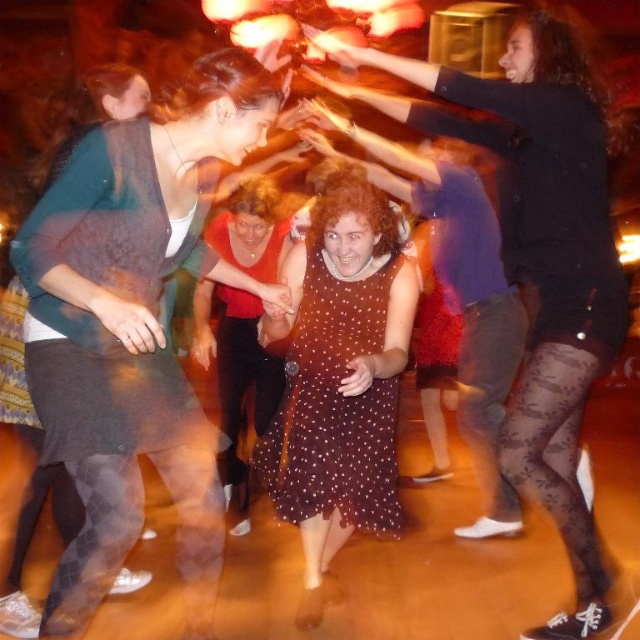
You are at a party and want to find the shortest dress among the dark brown textured dress at left and the brown dotted dress at center. Which one should you look for?

The dark brown textured dress at left is shorter than the brown dotted dress at center, so you should look for the dark brown textured dress at left.